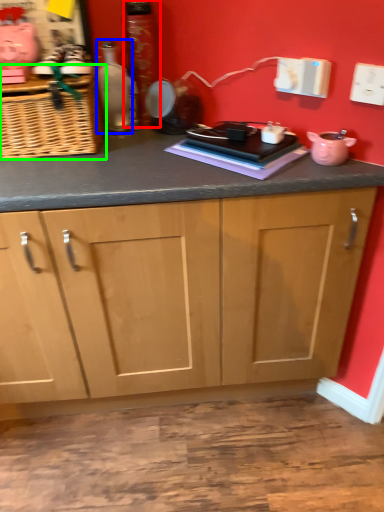
Question: Considering the real-world distances, which object is closest to bottle (highlighted by a red box)? bottle (highlighted by a blue box) or basket (highlighted by a green box).

Choices:
 (A) bottle
 (B) basket

Answer: (A)